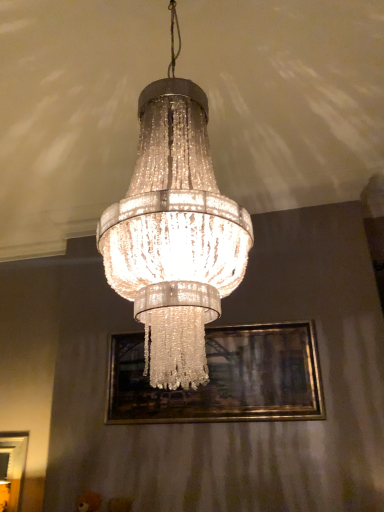
This screenshot has width=384, height=512. What do you see at coordinates (174, 232) in the screenshot? I see `clear crystal chandelier at center` at bounding box center [174, 232].

Where is `clear crystal chandelier at center`? The image size is (384, 512). clear crystal chandelier at center is located at coordinates (174, 232).

In order to face clear crystal chandelier at center, should I rotate leftwards or rightwards?

You should rotate left by 2.091 degrees.

This screenshot has width=384, height=512. What are the coordinates of `gold metallic picture frame at center` in the screenshot? It's located at (224, 378).

Image resolution: width=384 pixels, height=512 pixels. What do you see at coordinates (224, 378) in the screenshot? I see `gold metallic picture frame at center` at bounding box center [224, 378].

From the picture: In order to face gold metallic picture frame at center, should I rotate leftwards or rightwards?

Rotate right and turn 2.134 degrees.

Where is `clear crystal chandelier at center`? clear crystal chandelier at center is located at coordinates (174, 232).

Which is more to the left, clear crystal chandelier at center or gold metallic picture frame at center?

clear crystal chandelier at center is more to the left.

Does clear crystal chandelier at center lie in front of gold metallic picture frame at center?

Yes, clear crystal chandelier at center is in front of gold metallic picture frame at center.

Is point (192, 176) farther from viewer compared to point (219, 386)?

No, it is in front of (219, 386).

From the image's perspective, is clear crystal chandelier at center above or below gold metallic picture frame at center?

From the image's perspective, clear crystal chandelier at center appears above gold metallic picture frame at center.

From a real-world perspective, is clear crystal chandelier at center physically located above or below gold metallic picture frame at center?

In terms of real-world spatial position, clear crystal chandelier at center is above gold metallic picture frame at center.

Considering the sizes of clear crystal chandelier at center and gold metallic picture frame at center in the image, is clear crystal chandelier at center wider or thinner than gold metallic picture frame at center?

In the image, clear crystal chandelier at center appears to be wider than gold metallic picture frame at center.

Considering the relative sizes of clear crystal chandelier at center and gold metallic picture frame at center in the image provided, is clear crystal chandelier at center shorter than gold metallic picture frame at center?

Incorrect, the height of clear crystal chandelier at center does not fall short of that of gold metallic picture frame at center.

Considering the relative sizes of clear crystal chandelier at center and gold metallic picture frame at center in the image provided, is clear crystal chandelier at center smaller than gold metallic picture frame at center?

Incorrect, clear crystal chandelier at center is not smaller in size than gold metallic picture frame at center.

Is clear crystal chandelier at center not inside gold metallic picture frame at center?

Yes, clear crystal chandelier at center is not within gold metallic picture frame at center.

Is there a large distance between clear crystal chandelier at center and gold metallic picture frame at center?

Absolutely, clear crystal chandelier at center is distant from gold metallic picture frame at center.

Could you tell me if clear crystal chandelier at center is turned towards gold metallic picture frame at center?

No, clear crystal chandelier at center does not turn towards gold metallic picture frame at center.

How many degrees apart are the facing directions of clear crystal chandelier at center and gold metallic picture frame at center?

The angular difference between clear crystal chandelier at center and gold metallic picture frame at center is 1.7 degrees.

This screenshot has height=512, width=384. There is a gold metallic picture frame at center. Find the location of `lamp above it (from a real-world perspective)`. lamp above it (from a real-world perspective) is located at coordinates (174, 232).

Is gold metallic picture frame at center to the left of clear crystal chandelier at center from the viewer's perspective?

No.

In the scene shown: Does gold metallic picture frame at center come in front of clear crystal chandelier at center?

No, it is not.

Which is further, (206, 332) or (201, 207)?

The point (206, 332) is more distant.

From the image's perspective, who appears lower, gold metallic picture frame at center or clear crystal chandelier at center?

gold metallic picture frame at center appears lower in the image.

From a real-world perspective, is gold metallic picture frame at center under clear crystal chandelier at center?

Yes.

Is gold metallic picture frame at center wider than clear crystal chandelier at center?

Incorrect, the width of gold metallic picture frame at center does not surpass that of clear crystal chandelier at center.

Between gold metallic picture frame at center and clear crystal chandelier at center, which one has more height?

clear crystal chandelier at center.

Based on their sizes in the image, would you say gold metallic picture frame at center is bigger or smaller than clear crystal chandelier at center?

In the image, gold metallic picture frame at center appears to be smaller than clear crystal chandelier at center.

Can clear crystal chandelier at center be found inside gold metallic picture frame at center?

No, clear crystal chandelier at center is located outside of gold metallic picture frame at center.

Does gold metallic picture frame at center touch clear crystal chandelier at center?

No, gold metallic picture frame at center is not with clear crystal chandelier at center.

From the picture: Is gold metallic picture frame at center oriented away from clear crystal chandelier at center?

No, gold metallic picture frame at center is not facing the opposite direction of clear crystal chandelier at center.

What's the angular difference between gold metallic picture frame at center and clear crystal chandelier at center's facing directions?

The angular difference between gold metallic picture frame at center and clear crystal chandelier at center is 1.7 degrees.

Where is `lamp in front of the gold metallic picture frame at center`? The width and height of the screenshot is (384, 512). lamp in front of the gold metallic picture frame at center is located at coordinates (174, 232).

Where is `picture frame on the right of clear crystal chandelier at center`? The height and width of the screenshot is (512, 384). picture frame on the right of clear crystal chandelier at center is located at coordinates (224, 378).

There is a gold metallic picture frame at center. At what (x,y) coordinates should I click in order to perform the action: click on lamp above it (from a real-world perspective). Please return your answer as a coordinate pair (x, y). The image size is (384, 512). Looking at the image, I should click on (174, 232).